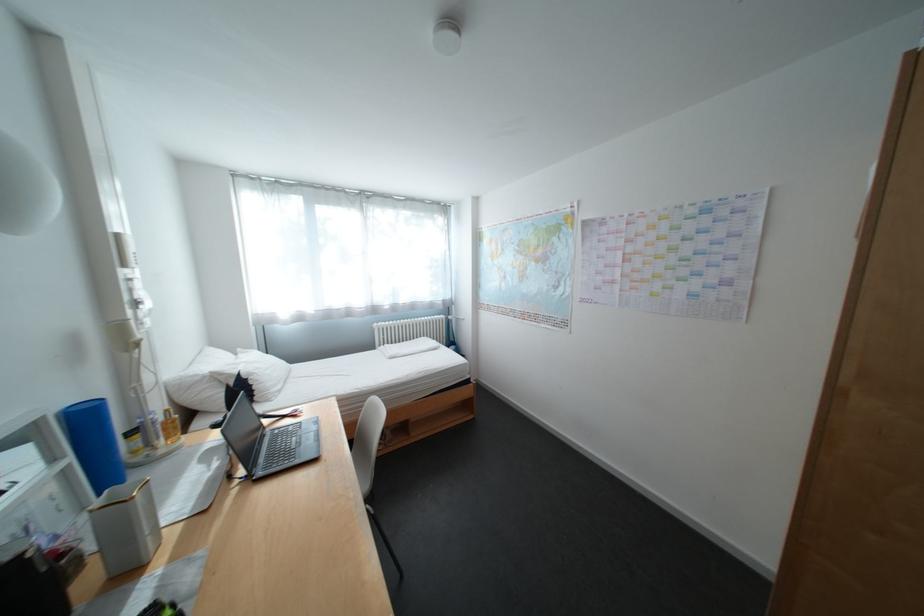
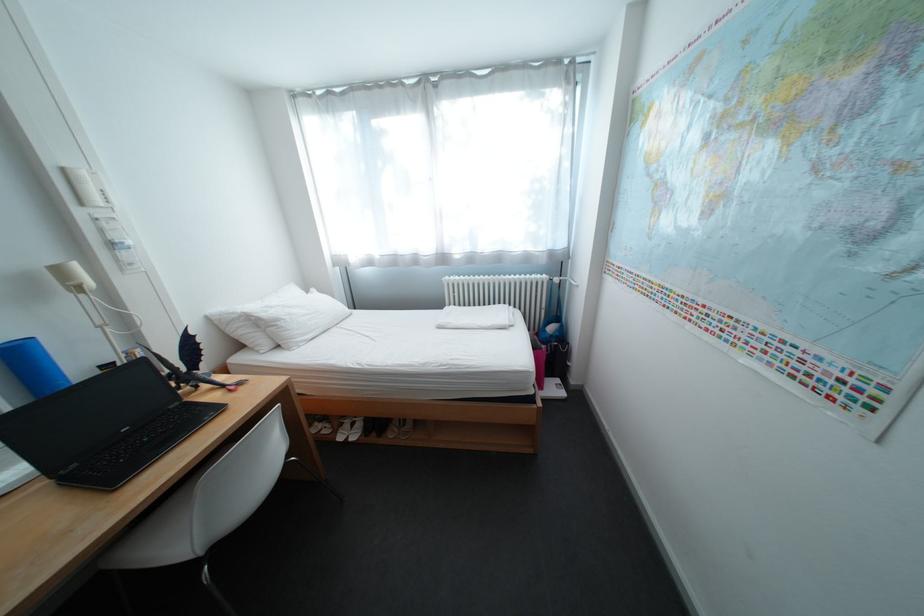
Locate, in the second image, the point that corresponds to the point at 481,378 in the first image.

(544, 392)